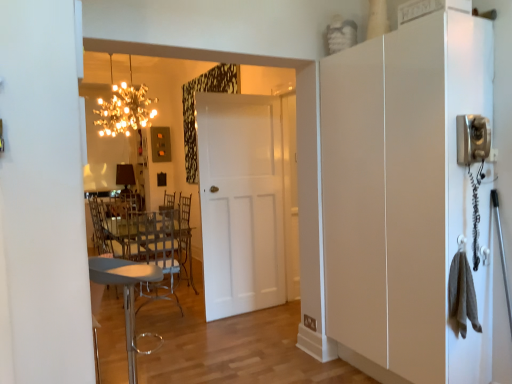
Image resolution: width=512 pixels, height=384 pixels. Describe the element at coordinates (125, 108) in the screenshot. I see `sparkling crystal chandelier at upper center` at that location.

At what (x,y) coordinates should I click in order to perform the action: click on white matte cabinet at right. Please return your answer as a coordinate pair (x, y). The width and height of the screenshot is (512, 384). Looking at the image, I should click on (404, 197).

Where is `clear plastic chair at center, which is the 2th chair from front to back`? Image resolution: width=512 pixels, height=384 pixels. clear plastic chair at center, which is the 2th chair from front to back is located at coordinates (156, 250).

Is sparkling crystal chandelier at upper center to the left of white matte cabinet at right from the viewer's perspective?

Yes.

From the image's perspective, is sparkling crystal chandelier at upper center under white matte cabinet at right?

Actually, sparkling crystal chandelier at upper center appears above white matte cabinet at right in the image.

In order to click on cabinetry on the right side of sparkling crystal chandelier at upper center in this screenshot , I will do `click(404, 197)`.

In terms of size, does sparkling crystal chandelier at upper center appear bigger or smaller than white matte cabinet at right?

Clearly, sparkling crystal chandelier at upper center is smaller in size than white matte cabinet at right.

Which point is more distant from viewer, (331, 62) or (149, 107)?

The point (149, 107) is more distant.

How different are the orientations of white matte cabinet at right and sparkling crystal chandelier at upper center in degrees?

The angular difference between white matte cabinet at right and sparkling crystal chandelier at upper center is 0.355 degrees.

Is white matte cabinet at right taller or shorter than sparkling crystal chandelier at upper center?

In the image, white matte cabinet at right appears to be taller than sparkling crystal chandelier at upper center.

Does white matte cabinet at right come behind sparkling crystal chandelier at upper center?

No, the depth of white matte cabinet at right is less than that of sparkling crystal chandelier at upper center.

Does white matte door at center have a greater height compared to white matte cabinet at right?

In fact, white matte door at center may be shorter than white matte cabinet at right.

Is the depth of white matte door at center greater than that of white matte cabinet at right?

Yes, the depth of white matte door at center is greater than that of white matte cabinet at right.

Choose the correct answer: Is white matte door at center inside white matte cabinet at right or outside it?

white matte door at center is not inside white matte cabinet at right, it's outside.

Is clear plastic chair at center, which is the 1th chair in back-to-front order, positioned with its back to metallic gray stool at lower left, which ranks as the 1th chair in front-to-back order?

clear plastic chair at center, which is the 1th chair in back-to-front order, is not turned away from metallic gray stool at lower left, which ranks as the 1th chair in front-to-back order.

Is clear plastic chair at center, which is the 1th chair in back-to-front order, not within metallic gray stool at lower left, which ranks as the 1th chair in front-to-back order?

Yes, clear plastic chair at center, which is the 1th chair in back-to-front order, is not within metallic gray stool at lower left, which ranks as the 1th chair in front-to-back order.

From a real-world perspective, is clear plastic chair at center, which is the 1th chair in back-to-front order, over metallic gray stool at lower left, which ranks as the 1th chair in front-to-back order?

Correct, in the physical world, clear plastic chair at center, which is the 1th chair in back-to-front order, is higher than metallic gray stool at lower left, which ranks as the 1th chair in front-to-back order.

In order to click on chair on the right side of clear plastic chair at center, which is the 2th chair from front to back in this screenshot , I will do `click(127, 297)`.

Which object is further away from the camera, clear plastic chair at center, which is the 1th chair in back-to-front order, or white matte door at center?

clear plastic chair at center, which is the 1th chair in back-to-front order, is behind.

Identify the location of door on the right of clear plastic chair at center, which is the 2th chair from front to back. (241, 202).

From the image's perspective, does clear plastic chair at center, which is the 2th chair from front to back, appear higher than white matte door at center?

No, from the image's perspective, clear plastic chair at center, which is the 2th chair from front to back, is not over white matte door at center.

Between clear plastic chair at center, which is the 2th chair from front to back, and white matte door at center, which one has smaller width?

white matte door at center.

How distant is clear plastic chair at center, which is the 1th chair in back-to-front order, from sparkling crystal chandelier at upper center?

They are 4.60 feet apart.

Based on the photo, is clear plastic chair at center, which is the 1th chair in back-to-front order, positioned beyond the bounds of sparkling crystal chandelier at upper center?

clear plastic chair at center, which is the 1th chair in back-to-front order, is positioned outside sparkling crystal chandelier at upper center.

In terms of height, does clear plastic chair at center, which is the 1th chair in back-to-front order, look taller or shorter compared to sparkling crystal chandelier at upper center?

In the image, clear plastic chair at center, which is the 1th chair in back-to-front order, appears to be taller than sparkling crystal chandelier at upper center.

In the scene shown: From the image's perspective, is clear plastic chair at center, which is the 2th chair from front to back, positioned above or below sparkling crystal chandelier at upper center?

clear plastic chair at center, which is the 2th chair from front to back, is situated lower than sparkling crystal chandelier at upper center in the image.

Which of these two, white matte cabinet at right or white matte door at center, is smaller?

white matte door at center is smaller.

Measure the distance between white matte cabinet at right and white matte door at center.

white matte cabinet at right is 5.31 feet from white matte door at center.

The width and height of the screenshot is (512, 384). I want to click on door behind the white matte cabinet at right, so click(x=241, y=202).

Is point (385, 377) positioned in front of point (275, 118)?

That is True.

Where is `light fixture on the left of white matte cabinet at right`? This screenshot has width=512, height=384. light fixture on the left of white matte cabinet at right is located at coordinates (125, 108).

Identify the location of cabinetry below the sparkling crystal chandelier at upper center (from the image's perspective). This screenshot has width=512, height=384. (x=404, y=197).

Based on their spatial positions, is sparkling crystal chandelier at upper center or clear plastic chair at center, which is the 1th chair in back-to-front order, closer to white matte door at center?

clear plastic chair at center, which is the 1th chair in back-to-front order, is positioned closer to the anchor white matte door at center.

Looking at the image, which one is located closer to sparkling crystal chandelier at upper center, clear plastic chair at center, which is the 2th chair from front to back, or metallic gray stool at lower left, which ranks as the 1th chair in front-to-back order?

The object closer to sparkling crystal chandelier at upper center is clear plastic chair at center, which is the 2th chair from front to back.

Considering their positions, is white matte door at center positioned closer to sparkling crystal chandelier at upper center than clear plastic chair at center, which is the 1th chair in back-to-front order?

clear plastic chair at center, which is the 1th chair in back-to-front order, is closer to sparkling crystal chandelier at upper center.

Estimate the real-world distances between objects in this image. Which object is closer to white matte door at center, white matte cabinet at right or sparkling crystal chandelier at upper center?

Based on the image, sparkling crystal chandelier at upper center appears to be nearer to white matte door at center.

From the image, which object appears to be nearer to white matte cabinet at right, clear plastic chair at center, which is the 2th chair from front to back, or metallic gray stool at lower left, the 2th chair from the back?

metallic gray stool at lower left, the 2th chair from the back, is positioned closer to the anchor white matte cabinet at right.

Looking at the image, which one is located closer to metallic gray stool at lower left, which ranks as the 1th chair in front-to-back order, sparkling crystal chandelier at upper center or white matte cabinet at right?

white matte cabinet at right is closer to metallic gray stool at lower left, which ranks as the 1th chair in front-to-back order.

Which object lies further to the anchor point white matte door at center, white matte cabinet at right or metallic gray stool at lower left, which ranks as the 1th chair in front-to-back order?

white matte cabinet at right is positioned further to the anchor white matte door at center.

Considering their positions, is white matte door at center positioned closer to white matte cabinet at right than metallic gray stool at lower left, which ranks as the 1th chair in front-to-back order?

The object closer to white matte cabinet at right is white matte door at center.

Identify the location of door that lies between sparkling crystal chandelier at upper center and clear plastic chair at center, which is the 2th chair from front to back, from top to bottom. The image size is (512, 384). (241, 202).

Where is `door located between white matte cabinet at right and sparkling crystal chandelier at upper center in the depth direction`? door located between white matte cabinet at right and sparkling crystal chandelier at upper center in the depth direction is located at coordinates coord(241,202).

At what (x,y) coordinates should I click in order to perform the action: click on door located between white matte cabinet at right and clear plastic chair at center, which is the 1th chair in back-to-front order, in the depth direction. Please return your answer as a coordinate pair (x, y). The image size is (512, 384). Looking at the image, I should click on (241, 202).

Locate an element on the screen. This screenshot has width=512, height=384. door between metallic gray stool at lower left, the 2th chair from the back, and sparkling crystal chandelier at upper center in the front-back direction is located at coordinates (241, 202).